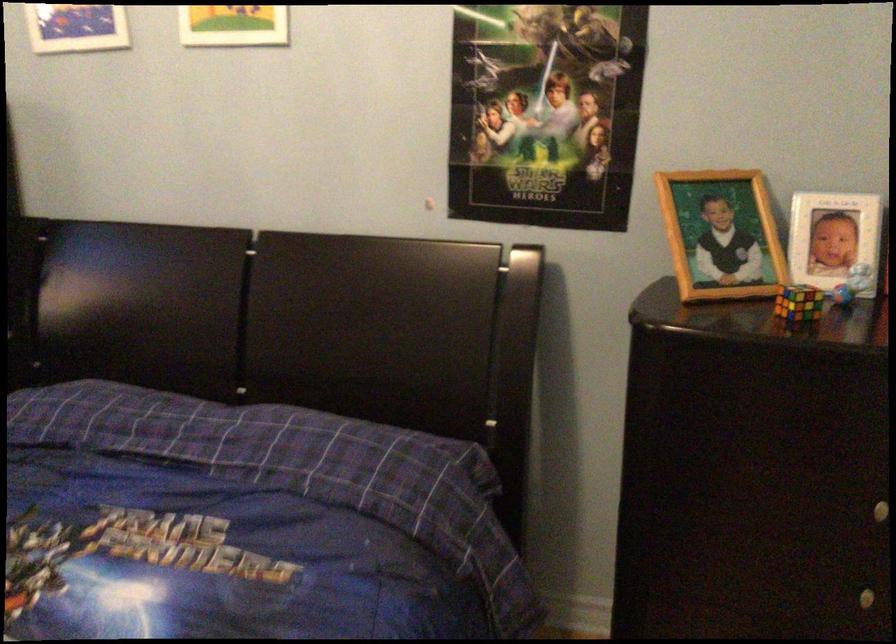
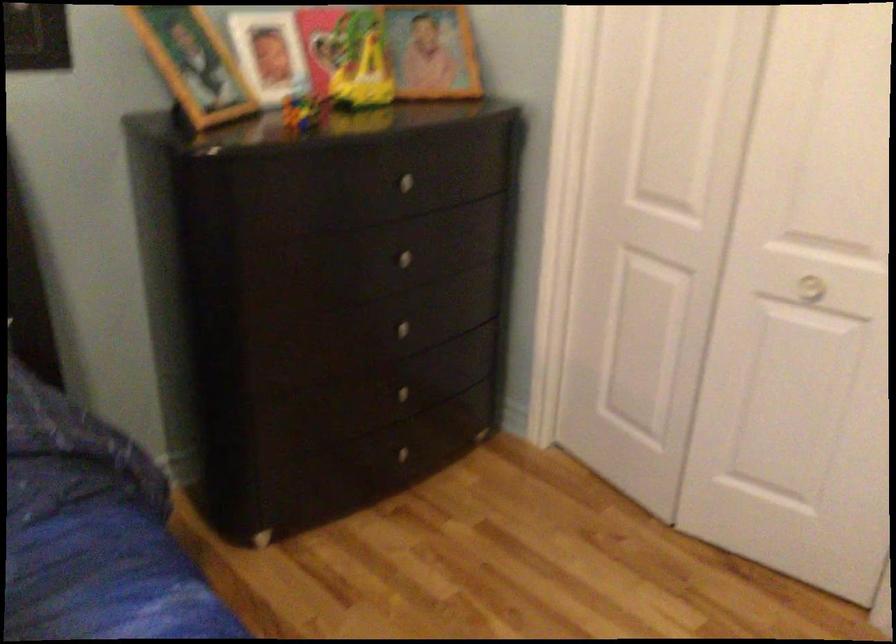
Where in the second image is the point corresponding to point 797,307 from the first image?

(303, 111)